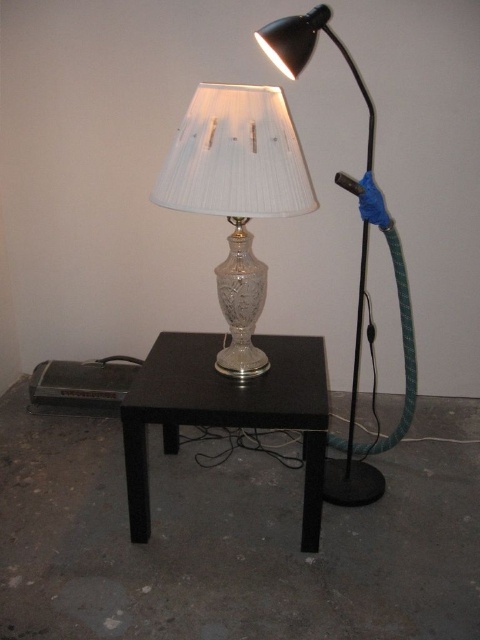
Which is below, black glossy table at center or matte silver glass table lamp at right?

black glossy table at center is lower down.

Who is more forward, (130, 474) or (290, 22)?

Positioned in front is point (290, 22).

This screenshot has height=640, width=480. Find the location of `black glossy table at center`. black glossy table at center is located at coordinates (227, 410).

Can you confirm if matte silver glass table lamp at right is smaller than green rubber hose at right?

Yes, matte silver glass table lamp at right is smaller than green rubber hose at right.

Measure the distance between point [355,504] and camera.

Point [355,504] and camera are 1.84 meters apart.

Image resolution: width=480 pixels, height=640 pixels. What do you see at coordinates (309, 52) in the screenshot? I see `matte silver glass table lamp at right` at bounding box center [309, 52].

Identify the location of matte silver glass table lamp at right. This screenshot has width=480, height=640. (309, 52).

Which of these two, silver textured glass table lamp at center or matte silver glass table lamp at right, stands shorter?

silver textured glass table lamp at center

Who is more distant from viewer, (261, 138) or (274, 26)?

Point (274, 26)

Is point (295, 192) positioned before point (372, 470)?

Yes, it is.

Where is `silver textured glass table lamp at center`? The image size is (480, 640). silver textured glass table lamp at center is located at coordinates (238, 195).